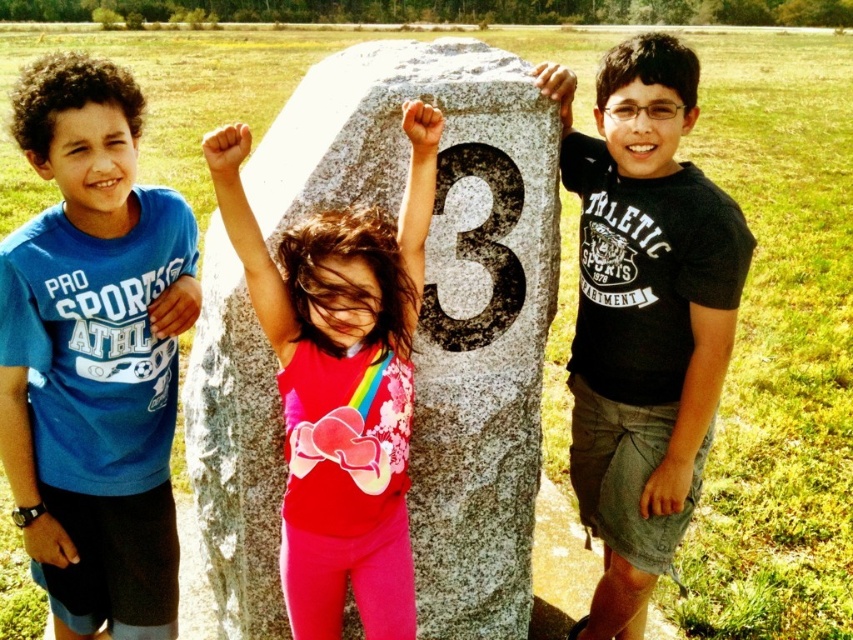
You are a photographer holding a camera and want to capture a closeup shot of the matte pink leggings at center. Based on the scene description, can you get a clear closeup without moving the camera? Explain your reasoning.

The matte pink leggings at center and camera are 8.02 feet apart. Since 8.02 feet is a reasonable distance for a clear closeup shot, you can capture a clear closeup without moving the camera.